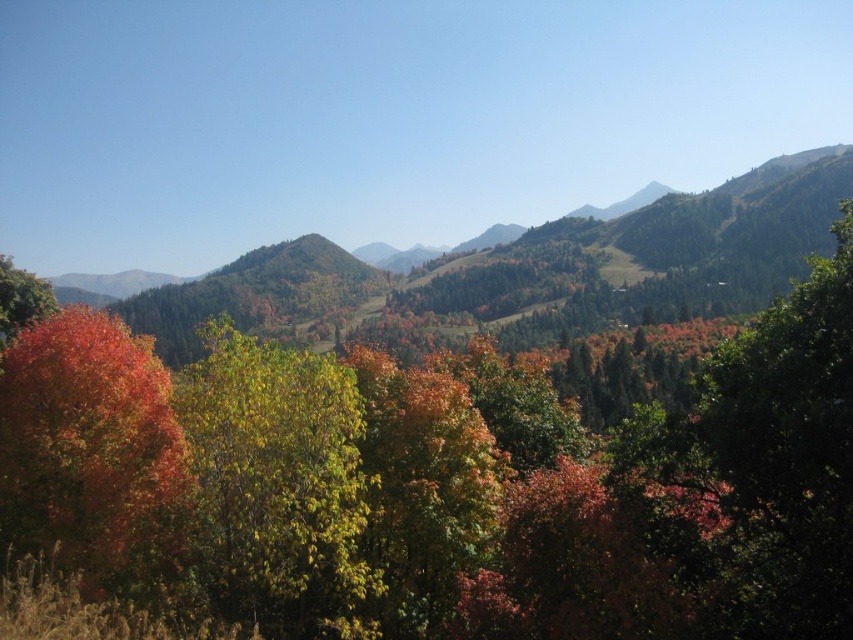
You are an artist painting the autumn scene. You want to place the shiny red leaves at left and the matte orange tree at left in your painting. According to the scene, which object is positioned to the right of the other?

The shiny red leaves at left are positioned to the right of the matte orange tree at left.